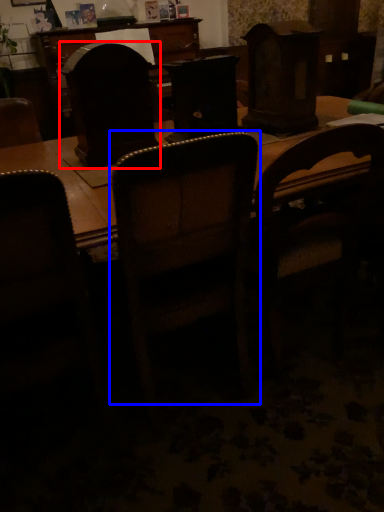
Question: Which object is closer to the camera taking this photo, swivel chair (highlighted by a red box) or chair (highlighted by a blue box)?

Choices:
 (A) swivel chair
 (B) chair

Answer: (B)